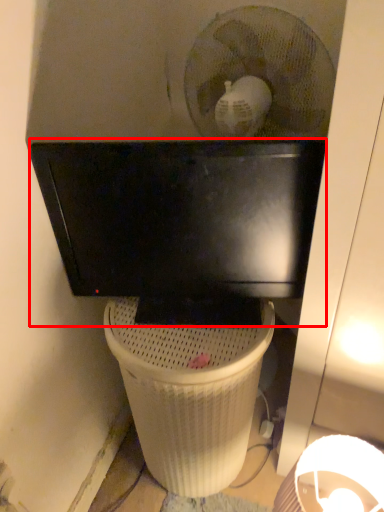
Question: Where is computer monitor (annotated by the red box) located in relation to waste container in the image?

Choices:
 (A) right
 (B) left

Answer: (A)